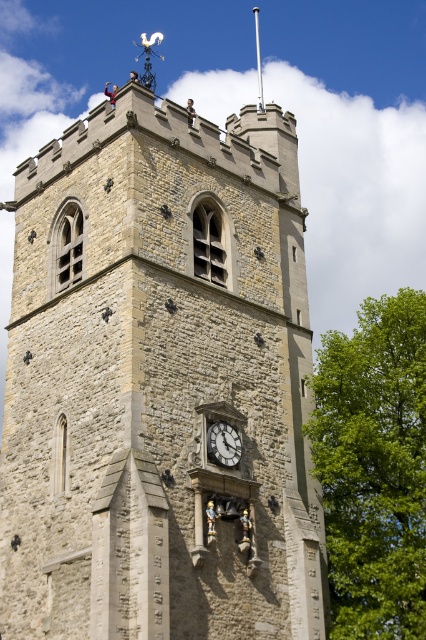
Is point (63, 609) positioned behind point (218, 454)?

That is False.

Who is higher up, stone clock tower at center or white stone clock at center?

stone clock tower at center is higher up.

Which is behind, point (175, 445) or point (233, 444)?

Positioned behind is point (233, 444).

Image resolution: width=426 pixels, height=640 pixels. Identify the location of stone clock tower at center. coord(160,381).

Who is lower down, green leafy tree at right or white stone clock at center?

Positioned lower is white stone clock at center.

Between point (353, 637) and point (221, 428), which one is positioned behind?

Point (353, 637)

Based on the photo, who is more distant from viewer, (x=399, y=317) or (x=239, y=451)?

Point (x=399, y=317)

I want to click on green leafy tree at right, so click(x=374, y=467).

Who is more distant from viewer, (210,208) or (354,387)?

The point (210,208) is more distant.

Which is in front, point (129, 477) or point (394, 512)?

Point (129, 477) is more forward.

Find the location of `stone clock tower at center`. stone clock tower at center is located at coordinates (160, 381).

Locate an element on the screen. stone clock tower at center is located at coordinates (160, 381).